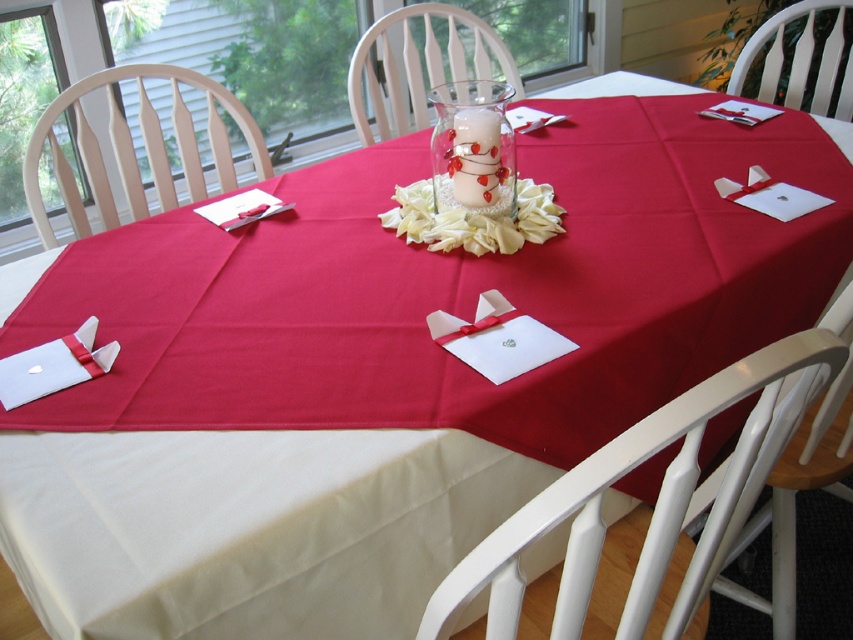
Is clear glass vase at center smaller than white fabric flower at center?

Correct, clear glass vase at center occupies less space than white fabric flower at center.

Can you confirm if clear glass vase at center is wider than white fabric flower at center?

In fact, clear glass vase at center might be narrower than white fabric flower at center.

Is point (434, 204) positioned behind point (511, 241)?

Yes, it is behind point (511, 241).

Image resolution: width=853 pixels, height=640 pixels. In order to click on clear glass vase at center in this screenshot , I will do `click(473, 147)`.